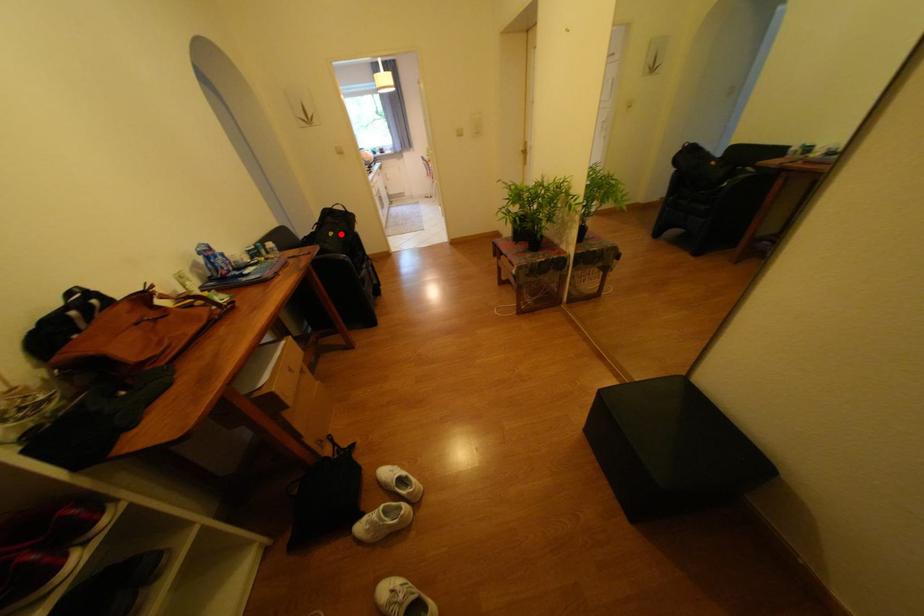
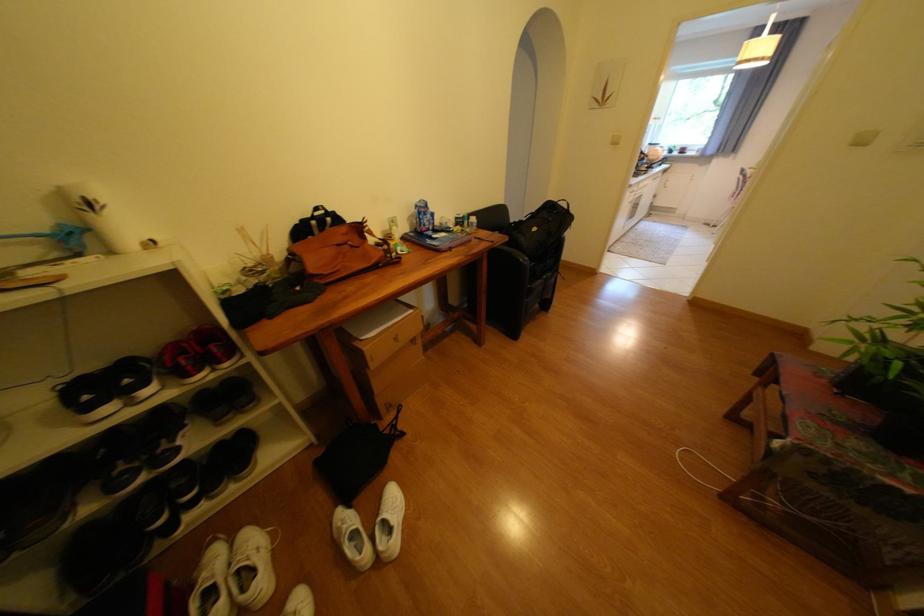
In the second image, find the point that corresponds to the highlighted location in the first image.

(543, 230)